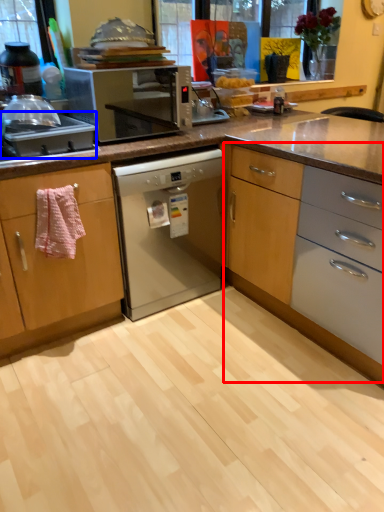
Question: Which object is further to the camera taking this photo, cabinetry (highlighted by a red box) or kitchen appliance (highlighted by a blue box)?

Choices:
 (A) cabinetry
 (B) kitchen appliance

Answer: (B)